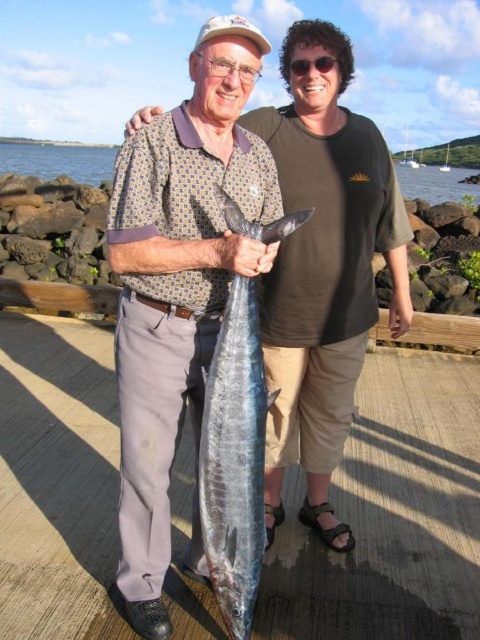
You are standing on the dock and want to move from point A to point B. Point A is located at coordinates point [48,579] and point B is at point [214,257]. Based on the scene description, which direction should you face to walk towards point B from point A?

To move from point A at coordinates point [48,579] to point B at point [214,257], you should face upwards because point A is behind point B, indicating that moving towards point B requires heading in the upward direction.